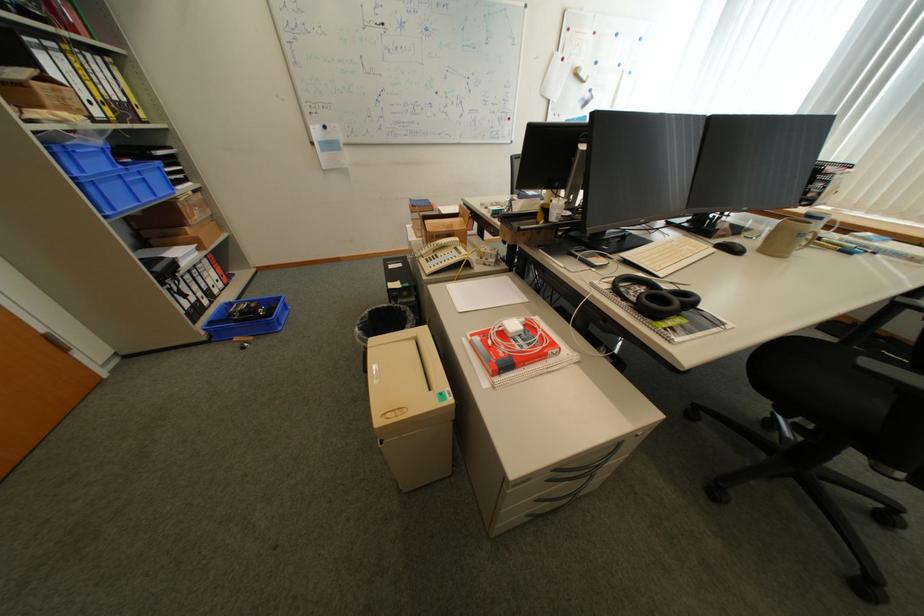
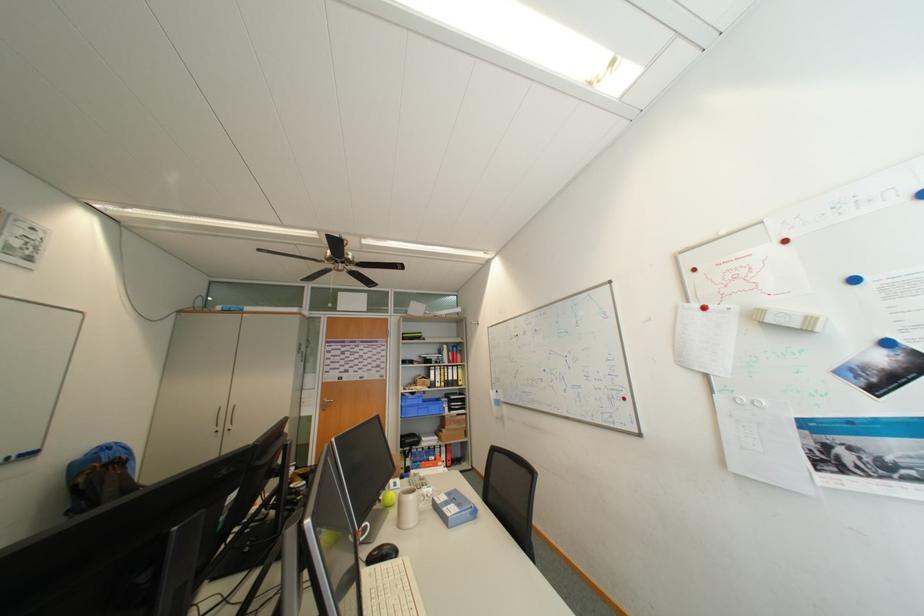
Find the pixel in the second image that matches point (106, 114) in the first image.

(447, 386)